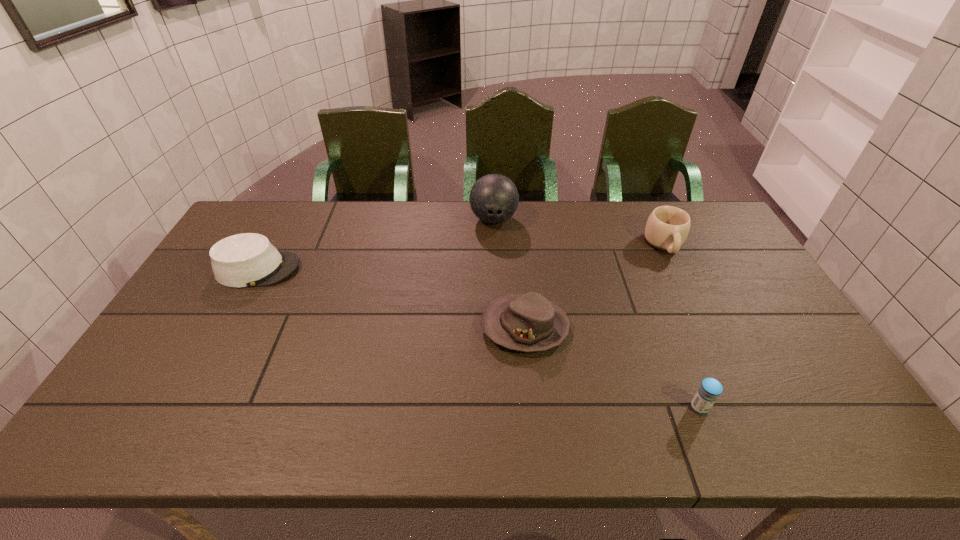
Locate an element on the screen. vacant area at the near edge of the desktop is located at coordinates (774, 443).

You are a GUI agent. You are given a task and a screenshot of the screen. Output one action in this format:
    pyautogui.click(x=<x>, y=<y>)
    Task: Click on the free location at the left edge
    Image resolution: width=960 pixels, height=540 pixels.
    Given the screenshot: What is the action you would take?
    pyautogui.click(x=195, y=369)

This screenshot has width=960, height=540. Find the location of `free spot at the right edge of the desktop`. free spot at the right edge of the desktop is located at coordinates (725, 276).

You are a GUI agent. You are given a task and a screenshot of the screen. Output one action in this format:
    pyautogui.click(x=<x>, y=<y>)
    Task: Click on the vacant space at the far left corner
    
    Given the screenshot: What is the action you would take?
    pyautogui.click(x=281, y=207)

Locate an element on the screen. This screenshot has height=540, width=960. free space at the far right corner of the desktop is located at coordinates (708, 230).

The height and width of the screenshot is (540, 960). Find the location of `vacant space at the near right corner of the desktop`. vacant space at the near right corner of the desktop is located at coordinates (847, 446).

Where is `unoccupied position between the second object from right to left and the farther hat`? The height and width of the screenshot is (540, 960). unoccupied position between the second object from right to left and the farther hat is located at coordinates (479, 338).

The width and height of the screenshot is (960, 540). Find the location of `vacant region between the bowling ball and the nearer hat`. vacant region between the bowling ball and the nearer hat is located at coordinates (509, 273).

The height and width of the screenshot is (540, 960). Find the location of `free space between the left hat and the second nearest object`. free space between the left hat and the second nearest object is located at coordinates (392, 298).

Where is `free spot between the nearest object and the rightmost object`? Image resolution: width=960 pixels, height=540 pixels. free spot between the nearest object and the rightmost object is located at coordinates (682, 326).